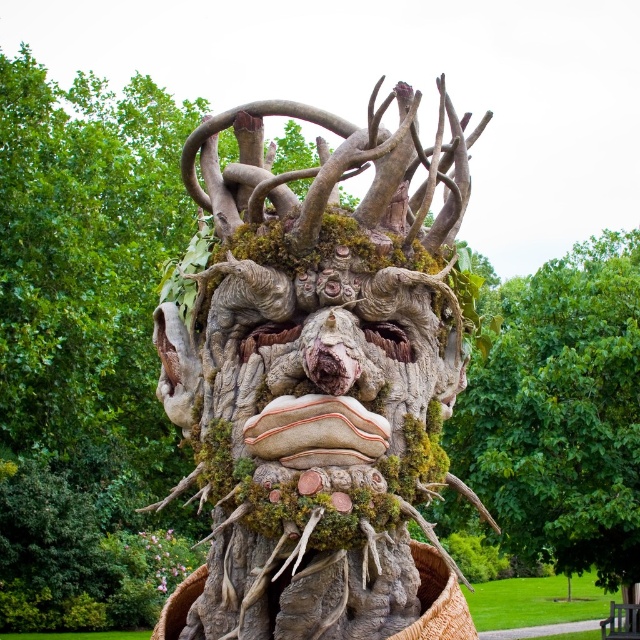
You are an artist planning to create a miniature version of the sculpture. You need to know which part is narrower between the rustic wood sculpture at center and the mossy bark tree trunk at center to scale them appropriately. Which one is narrower?

The rustic wood sculpture at center is narrower than the mossy bark tree trunk at center, so it should be scaled down accordingly.